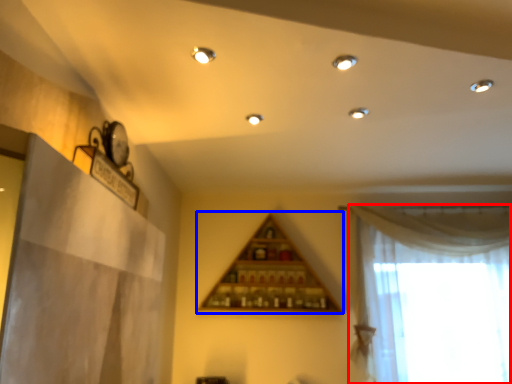
Question: Which of the following is the farthest to the observer, curtain (highlighted by a red box) or shelf (highlighted by a blue box)?

Choices:
 (A) curtain
 (B) shelf

Answer: (B)